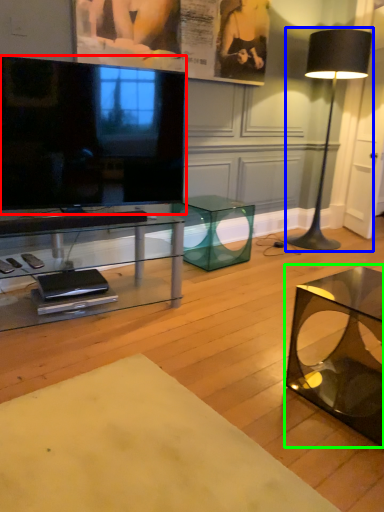
Question: Considering the real-world distances, which object is closest to television (highlighted by a red box)? lamp (highlighted by a blue box) or coffee table (highlighted by a green box).

Choices:
 (A) lamp
 (B) coffee table

Answer: (B)